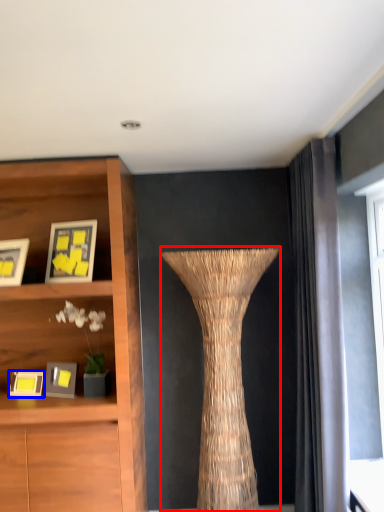
Question: Which of the following is the closest to the observer, vase (highlighted by a red box) or picture frame (highlighted by a blue box)?

Choices:
 (A) vase
 (B) picture frame

Answer: (A)